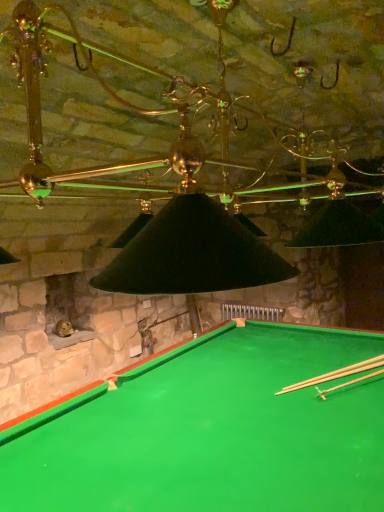
Describe the element at coordinates (211, 431) in the screenshot. This screenshot has height=512, width=384. I see `green felt billiard table at lower center` at that location.

What do you see at coordinates (347, 384) in the screenshot?
I see `light brown wooden cue at bottom right, which is counted as the 1th cue, starting from the front` at bounding box center [347, 384].

Measure the distance between smooth wood cue at bottom right, arranged as the first cue when viewed from the back, and camera.

A distance of 6.96 feet exists between smooth wood cue at bottom right, arranged as the first cue when viewed from the back, and camera.

Where is `green felt billiard table at lower center`? green felt billiard table at lower center is located at coordinates (211, 431).

From the image's perspective, which one is positioned lower, light brown wooden cue at bottom right, which is counted as the 1th cue, starting from the front, or smooth wood cue at bottom right, arranged as the first cue when viewed from the back?

smooth wood cue at bottom right, arranged as the first cue when viewed from the back, from the image's perspective.

From a real-world perspective, which object rests below the other?

smooth wood cue at bottom right, arranged as the first cue when viewed from the back, from a real-world perspective.

Between light brown wooden cue at bottom right, which is counted as the 1th cue, starting from the front, and smooth wood cue at bottom right, arranged as the first cue when viewed from the back, which one has smaller width?

light brown wooden cue at bottom right, which is counted as the 1th cue, starting from the front.

Is the depth of light brown wooden cue at bottom right, placed as the 2th cue when sorted from back to front, greater than that of smooth wood cue at bottom right, the 2th cue from the front?

No, the depth of light brown wooden cue at bottom right, placed as the 2th cue when sorted from back to front, is less than that of smooth wood cue at bottom right, the 2th cue from the front.

Does light brown wooden cue at bottom right, placed as the 2th cue when sorted from back to front, have a greater height compared to green felt billiard table at lower center?

In fact, light brown wooden cue at bottom right, placed as the 2th cue when sorted from back to front, may be shorter than green felt billiard table at lower center.

Is light brown wooden cue at bottom right, which is counted as the 1th cue, starting from the front, next to green felt billiard table at lower center?

No, light brown wooden cue at bottom right, which is counted as the 1th cue, starting from the front, is not with green felt billiard table at lower center.

Considering the positions of points (327, 391) and (55, 408), is point (327, 391) closer to camera compared to point (55, 408)?

No, it is behind (55, 408).

Can we say light brown wooden cue at bottom right, which is counted as the 1th cue, starting from the front, lies outside green felt billiard table at lower center?

Actually, light brown wooden cue at bottom right, which is counted as the 1th cue, starting from the front, is within green felt billiard table at lower center.

Is smooth wood cue at bottom right, the 2th cue from the front, to the left or to the right of green felt billiard table at lower center in the image?

smooth wood cue at bottom right, the 2th cue from the front, is positioned on green felt billiard table at lower center's right side.

Considering the positions of points (279, 392) and (161, 375), is point (279, 392) closer to camera compared to point (161, 375)?

Yes, it is in front of point (161, 375).

Considering the positions of point (167, 497) and point (371, 369), is point (167, 497) closer or farther from the camera than point (371, 369)?

Clearly, point (167, 497) is closer to the camera than point (371, 369).

From the image's perspective, is green felt billiard table at lower center located above or below smooth wood cue at bottom right, arranged as the first cue when viewed from the back?

Based on their image positions, green felt billiard table at lower center is located beneath smooth wood cue at bottom right, arranged as the first cue when viewed from the back.

Where is `cue that is the 1st object located above the green felt billiard table at lower center (from the image's perspective)`? This screenshot has width=384, height=512. cue that is the 1st object located above the green felt billiard table at lower center (from the image's perspective) is located at coordinates (336, 374).

Between green felt billiard table at lower center and smooth wood cue at bottom right, arranged as the first cue when viewed from the back, which one appears on the right side from the viewer's perspective?

From the viewer's perspective, smooth wood cue at bottom right, arranged as the first cue when viewed from the back, appears more on the right side.

Which point is more forward, (162, 372) or (341, 387)?

The point (341, 387) is more forward.

Between green felt billiard table at lower center and light brown wooden cue at bottom right, which is counted as the 1th cue, starting from the front, which one has smaller width?

Thinner between the two is light brown wooden cue at bottom right, which is counted as the 1th cue, starting from the front.

Is green felt billiard table at lower center facing towards light brown wooden cue at bottom right, placed as the 2th cue when sorted from back to front?

No, green felt billiard table at lower center does not turn towards light brown wooden cue at bottom right, placed as the 2th cue when sorted from back to front.

Does smooth wood cue at bottom right, the 2th cue from the front, appear on the right side of light brown wooden cue at bottom right, placed as the 2th cue when sorted from back to front?

Incorrect, smooth wood cue at bottom right, the 2th cue from the front, is not on the right side of light brown wooden cue at bottom right, placed as the 2th cue when sorted from back to front.

From the image's perspective, is smooth wood cue at bottom right, arranged as the first cue when viewed from the back, positioned above or below light brown wooden cue at bottom right, placed as the 2th cue when sorted from back to front?

Based on their image positions, smooth wood cue at bottom right, arranged as the first cue when viewed from the back, is located beneath light brown wooden cue at bottom right, placed as the 2th cue when sorted from back to front.

Between smooth wood cue at bottom right, arranged as the first cue when viewed from the back, and light brown wooden cue at bottom right, which is counted as the 1th cue, starting from the front, which one has smaller size?

smooth wood cue at bottom right, arranged as the first cue when viewed from the back, is smaller.

Is smooth wood cue at bottom right, the 2th cue from the front, positioned in front of light brown wooden cue at bottom right, which is counted as the 1th cue, starting from the front?

No, smooth wood cue at bottom right, the 2th cue from the front, is behind light brown wooden cue at bottom right, which is counted as the 1th cue, starting from the front.

In the image, there is a light brown wooden cue at bottom right, which is counted as the 1th cue, starting from the front. At what (x,y) coordinates should I click in order to perform the action: click on cue below it (from a real-world perspective). Please return your answer as a coordinate pair (x, y). The height and width of the screenshot is (512, 384). Looking at the image, I should click on (336, 374).

From the image's perspective, starting from the green felt billiard table at lower center, which cue is the 2nd one above? Please provide its 2D coordinates.

[(347, 384)]

When comparing their distances from smooth wood cue at bottom right, arranged as the first cue when viewed from the back, does light brown wooden cue at bottom right, which is counted as the 1th cue, starting from the front, or green felt billiard table at lower center seem closer?

light brown wooden cue at bottom right, which is counted as the 1th cue, starting from the front, is closer to smooth wood cue at bottom right, arranged as the first cue when viewed from the back.

Estimate the real-world distances between objects in this image. Which object is further from smooth wood cue at bottom right, the 2th cue from the front, green felt billiard table at lower center or light brown wooden cue at bottom right, placed as the 2th cue when sorted from back to front?

green felt billiard table at lower center lies further to smooth wood cue at bottom right, the 2th cue from the front, than the other object.

From the picture: Looking at the image, which one is located closer to green felt billiard table at lower center, smooth wood cue at bottom right, arranged as the first cue when viewed from the back, or light brown wooden cue at bottom right, which is counted as the 1th cue, starting from the front?

smooth wood cue at bottom right, arranged as the first cue when viewed from the back, is positioned closer to the anchor green felt billiard table at lower center.

From the image, which object appears to be nearer to light brown wooden cue at bottom right, placed as the 2th cue when sorted from back to front, smooth wood cue at bottom right, arranged as the first cue when viewed from the back, or green felt billiard table at lower center?

Based on the image, smooth wood cue at bottom right, arranged as the first cue when viewed from the back, appears to be nearer to light brown wooden cue at bottom right, placed as the 2th cue when sorted from back to front.

Looking at the image, which one is located closer to green felt billiard table at lower center, light brown wooden cue at bottom right, placed as the 2th cue when sorted from back to front, or smooth wood cue at bottom right, arranged as the first cue when viewed from the back?

Based on the image, smooth wood cue at bottom right, arranged as the first cue when viewed from the back, appears to be nearer to green felt billiard table at lower center.

Based on their spatial positions, is green felt billiard table at lower center or smooth wood cue at bottom right, the 2th cue from the front, closer to light brown wooden cue at bottom right, which is counted as the 1th cue, starting from the front?

smooth wood cue at bottom right, the 2th cue from the front, is positioned closer to the anchor light brown wooden cue at bottom right, which is counted as the 1th cue, starting from the front.

Where is `cue between green felt billiard table at lower center and smooth wood cue at bottom right, the 2th cue from the front, along the z-axis`? The height and width of the screenshot is (512, 384). cue between green felt billiard table at lower center and smooth wood cue at bottom right, the 2th cue from the front, along the z-axis is located at coordinates (347, 384).